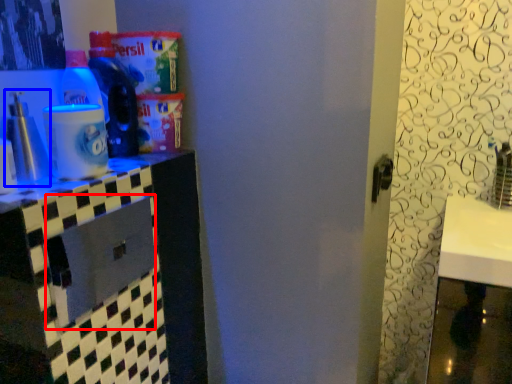
Question: Among these objects, which one is farthest to the camera, drawer (highlighted by a red box) or bottle (highlighted by a blue box)?

Choices:
 (A) drawer
 (B) bottle

Answer: (B)